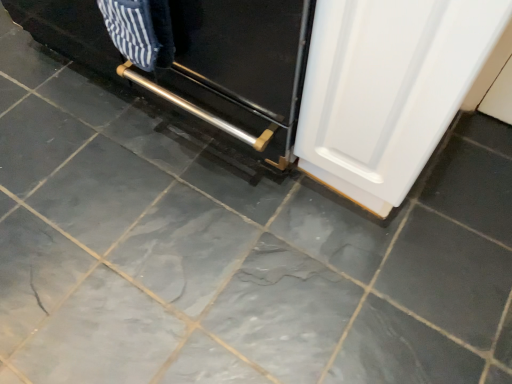
Question: Is white glossy door at lower right in front of or behind metallic silver oven at center in the image?

Choices:
 (A) front
 (B) behind

Answer: (A)

Question: Is white glossy door at lower right situated inside metallic silver oven at center or outside?

Choices:
 (A) outside
 (B) inside

Answer: (A)

Question: Considering the positions of point (489, 11) and point (196, 43), is point (489, 11) closer or farther from the camera than point (196, 43)?

Choices:
 (A) closer
 (B) farther

Answer: (A)

Question: From a real-world perspective, relative to white glossy door at lower right, is metallic silver oven at center vertically above or below?

Choices:
 (A) below
 (B) above

Answer: (A)

Question: From the image's perspective, is metallic silver oven at center positioned above or below white glossy door at lower right?

Choices:
 (A) above
 (B) below

Answer: (A)

Question: Considering the positions of point (298, 89) and point (449, 18), is point (298, 89) closer or farther from the camera than point (449, 18)?

Choices:
 (A) farther
 (B) closer

Answer: (A)

Question: In terms of height, does metallic silver oven at center look taller or shorter compared to white glossy door at lower right?

Choices:
 (A) tall
 (B) short

Answer: (B)